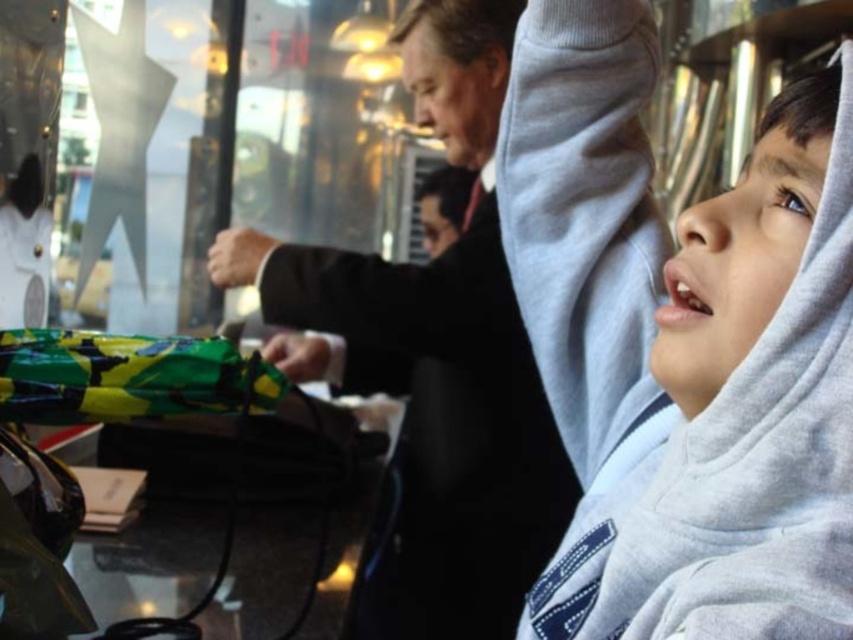
Question: Can you confirm if gray fleece hoodie at upper right is positioned to the left of black matte suit at center?

Choices:
 (A) no
 (B) yes

Answer: (A)

Question: Does gray fleece hoodie at upper right have a lesser width compared to black matte suit at center?

Choices:
 (A) yes
 (B) no

Answer: (A)

Question: Which point is closer to the camera taking this photo?

Choices:
 (A) (538, 209)
 (B) (527, 564)

Answer: (A)

Question: Among these objects, which one is nearest to the camera?

Choices:
 (A) black matte suit at center
 (B) gray fleece hoodie at upper right

Answer: (B)

Question: Which point is farther from the camera taking this photo?

Choices:
 (A) (473, 413)
 (B) (782, 531)

Answer: (A)

Question: Does gray fleece hoodie at upper right have a lesser width compared to black matte suit at center?

Choices:
 (A) no
 (B) yes

Answer: (B)